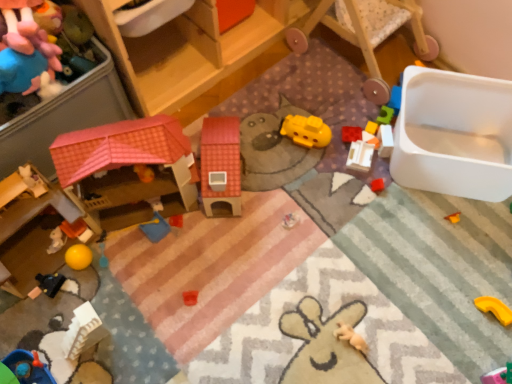
The width and height of the screenshot is (512, 384). Find the location of `free space in front of white plastic blocks at right, placed as the tenth toy when sorted from left to right`. free space in front of white plastic blocks at right, placed as the tenth toy when sorted from left to right is located at coordinates (390, 197).